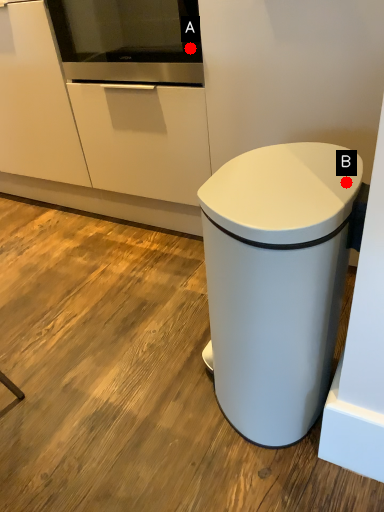
Question: Two points are circled on the image, labeled by A and B beside each circle. Which point is closer to the camera taking this photo?

Choices:
 (A) A is closer
 (B) B is closer

Answer: (B)